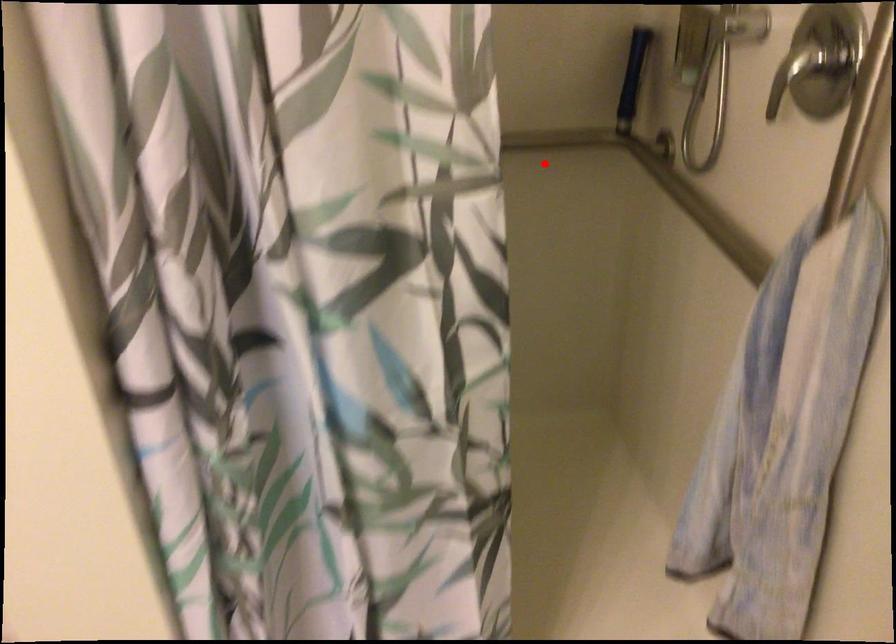
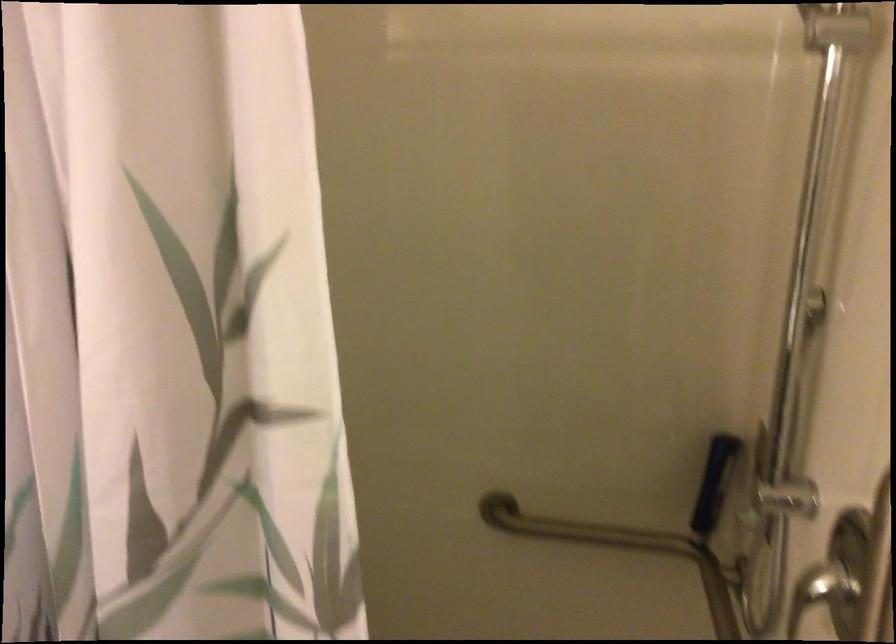
Question: I am providing you with two images of the same scene from different viewpoints. A red point is shown in image1. For the corresponding object point in image2, is it positioned nearer or farther from the camera?

Choices:
 (A) Nearer
 (B) Farther

Answer: (A)